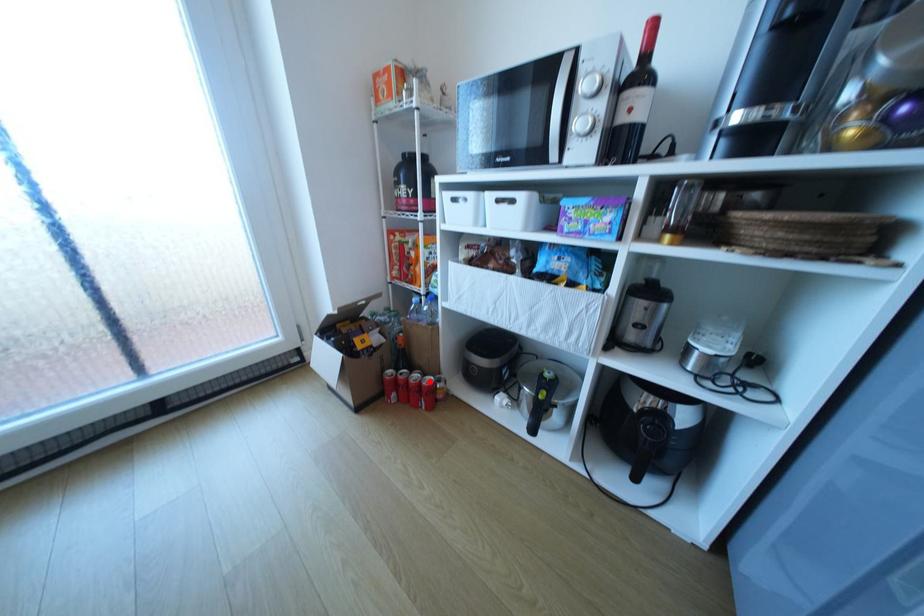
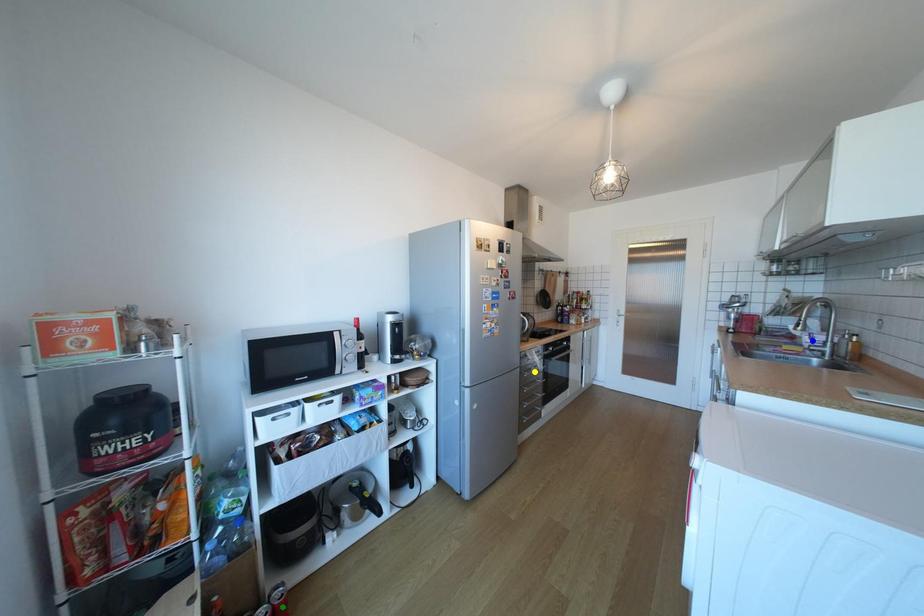
Question: I am providing you with two images of the same scene from different viewpoints. A red point is marked on the first image. You are given multiple points on the second image. Which spot in image 2 lines up with the point in image 1?

Choices:
 (A) blue point
 (B) green point
 (C) yellow point

Answer: (B)